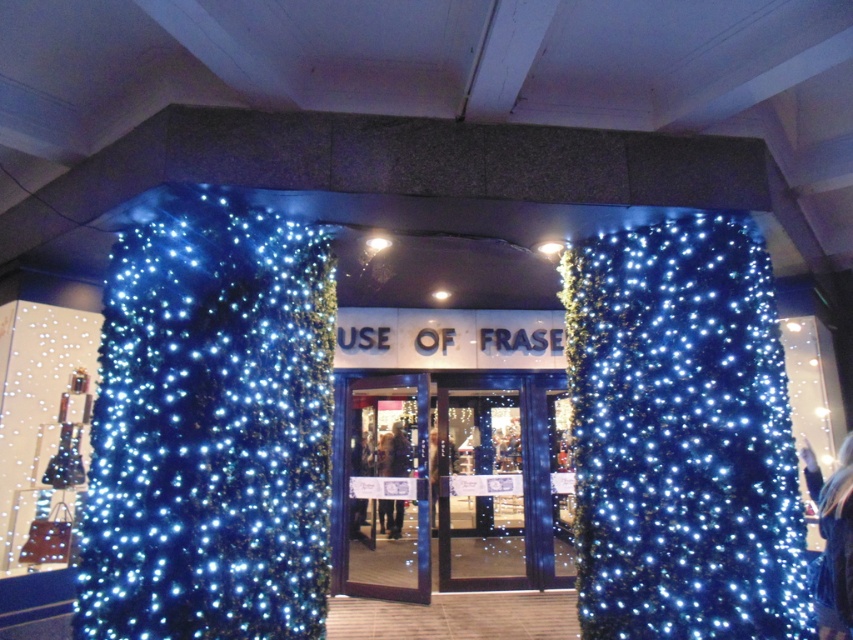
Is point (357, 429) closer to camera compared to point (468, 588)?

No, it is not.

Does shiny dark blue door at center come in front of transparent glass door at center?

Yes.

Which is behind, point (364, 449) or point (450, 413)?

The point (450, 413) is more distant.

I want to click on shiny dark blue door at center, so click(x=383, y=486).

Which is below, blue led lights at left or blue glass doors at center?

blue glass doors at center is lower down.

Does point (252, 320) come in front of point (399, 380)?

That is True.

I want to click on blue led lights at left, so click(210, 429).

Which of these two, illuminated blue lights at center or blue glass doors at center, stands shorter?

illuminated blue lights at center is shorter.

Is illuminated blue lights at center below blue glass doors at center?

Actually, illuminated blue lights at center is above blue glass doors at center.

Is point (585, 592) positioned before point (364, 428)?

Yes.

Where is `illuminated blue lights at center`? Image resolution: width=853 pixels, height=640 pixels. illuminated blue lights at center is located at coordinates (682, 436).